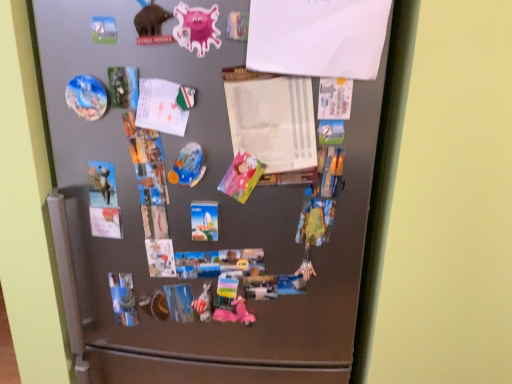
Where is `metallic silver statue at center, which appears as the second art when viewed from the right`? The width and height of the screenshot is (512, 384). metallic silver statue at center, which appears as the second art when viewed from the right is located at coordinates (204, 303).

Locate an element on the screen. The height and width of the screenshot is (384, 512). matte plastic magnet at upper left, the 4th art positioned from the bottom is located at coordinates (86, 97).

Image resolution: width=512 pixels, height=384 pixels. What do you see at coordinates (317, 37) in the screenshot?
I see `white paper at upper center, the first paper positioned from the front` at bounding box center [317, 37].

You are a GUI agent. You are given a task and a screenshot of the screen. Output one action in this format:
    pyautogui.click(x=<x>, y=<y>)
    Task: Click on the white paper at center, the 1th paper from the back
    The width and height of the screenshot is (512, 384).
    Given the screenshot: What is the action you would take?
    pyautogui.click(x=273, y=121)

Is white paper at upper center, positioned as the 1th paper in top-to-bottom order, not close to shiny metallic plate at center, positioned as the third art in bottom-to-top order?

They are positioned close to each other.

From the image's perspective, is white paper at upper center, acting as the 2th paper starting from the bottom, located above or below shiny metallic plate at center, the 3th art viewed from the right?

white paper at upper center, acting as the 2th paper starting from the bottom, is situated higher than shiny metallic plate at center, the 3th art viewed from the right, in the image.

Is white paper at upper center, arranged as the second paper when viewed from the back, in front of or behind shiny metallic plate at center, the 3th art viewed from the right, in the image?

white paper at upper center, arranged as the second paper when viewed from the back, is positioned closer to the viewer than shiny metallic plate at center, the 3th art viewed from the right.

Who is taller, white paper at upper center, arranged as the second paper when viewed from the back, or shiny metallic plate at center, the second art from the left?

Standing taller between the two is white paper at upper center, arranged as the second paper when viewed from the back.

Does shiny metallic plate at center, the second art from the left, have a smaller size compared to metallic silver statue at center, marked as the third art in a left-to-right arrangement?

No, shiny metallic plate at center, the second art from the left, is not smaller than metallic silver statue at center, marked as the third art in a left-to-right arrangement.

Which object is closer to the camera, shiny metallic plate at center, positioned as the third art in bottom-to-top order, or metallic silver statue at center, marked as the third art in a left-to-right arrangement?

shiny metallic plate at center, positioned as the third art in bottom-to-top order.

Could you tell me if shiny metallic plate at center, the second art from the left, is facing metallic silver statue at center, which appears as the second art when viewed from the right?

No, shiny metallic plate at center, the second art from the left, is not turned towards metallic silver statue at center, which appears as the second art when viewed from the right.

Is point (183, 172) behind point (204, 314)?

No.

Would you say matte plastic magnet at upper left, the 4th art positioned from the bottom, is outside metallic silver statue at center, marked as the third art in a left-to-right arrangement?

Yes, matte plastic magnet at upper left, the 4th art positioned from the bottom, is outside of metallic silver statue at center, marked as the third art in a left-to-right arrangement.

Find the location of a particular element. art that is the 2nd object located behind the matte plastic magnet at upper left, positioned as the first art in top-to-bottom order is located at coordinates (204, 303).

Considering the sizes of objects matte plastic magnet at upper left, which is counted as the 4th art, starting from the right, and metallic silver statue at center, marked as the third art in a left-to-right arrangement, in the image provided, who is thinner, matte plastic magnet at upper left, which is counted as the 4th art, starting from the right, or metallic silver statue at center, marked as the third art in a left-to-right arrangement,?

Thinner between the two is matte plastic magnet at upper left, which is counted as the 4th art, starting from the right.

Which object is closer to the camera, pastel paper art at center, which is the fourth art in left-to-right order, or satin silver fridge at center?

Positioned in front is satin silver fridge at center.

Is pastel paper art at center, which is the fourth art in left-to-right order, touching satin silver fridge at center?

No, pastel paper art at center, which is the fourth art in left-to-right order, is not with satin silver fridge at center.

From the image's perspective, is pastel paper art at center, which is the fourth art in left-to-right order, located above satin silver fridge at center?

Correct, pastel paper art at center, which is the fourth art in left-to-right order, appears higher than satin silver fridge at center in the image.

Would you say pastel paper art at center, the 1th art when ordered from right to left, is inside or outside satin silver fridge at center?

pastel paper art at center, the 1th art when ordered from right to left, can be found inside satin silver fridge at center.

This screenshot has height=384, width=512. I want to click on refrigerator above the metallic silver statue at center, which appears as the second art when viewed from the right (from the image's perspective), so click(191, 222).

Considering the points (208, 317) and (170, 27), which point is in front, point (208, 317) or point (170, 27)?

Point (170, 27)

Which object is more forward, metallic silver statue at center, the 4th art when ordered from top to bottom, or satin silver fridge at center?

satin silver fridge at center.

Would you say white paper at center, the first paper ordered from the bottom, is part of shiny metallic plate at center, the second art from the left,'s contents?

No, white paper at center, the first paper ordered from the bottom, is located outside of shiny metallic plate at center, the second art from the left.

Is white paper at center, the 1th paper from the back, at the back of shiny metallic plate at center, the 3th art viewed from the right?

No, shiny metallic plate at center, the 3th art viewed from the right, is not facing the opposite direction of white paper at center, the 1th paper from the back.

Looking at this image, does shiny metallic plate at center, the 2th art from the top, have a lesser height compared to white paper at center, the 2th paper when ordered from top to bottom?

Yes, shiny metallic plate at center, the 2th art from the top, is shorter than white paper at center, the 2th paper when ordered from top to bottom.

Can we say white paper at center, the first paper ordered from the bottom, lies outside satin silver fridge at center?

That's incorrect, white paper at center, the first paper ordered from the bottom, is not completely outside satin silver fridge at center.

Considering the relative sizes of white paper at center, the 2th paper when ordered from top to bottom, and satin silver fridge at center in the image provided, is white paper at center, the 2th paper when ordered from top to bottom, smaller than satin silver fridge at center?

Yes, white paper at center, the 2th paper when ordered from top to bottom, is smaller than satin silver fridge at center.

Is white paper at center, the 2th paper when ordered from top to bottom, positioned with its back to satin silver fridge at center?

Yes, white paper at center, the 2th paper when ordered from top to bottom, is facing away from satin silver fridge at center.

This screenshot has width=512, height=384. There is a shiny metallic plate at center, the 3th art viewed from the right. What are the coordinates of `the 2nd paper above it (from the image's perspective)` in the screenshot? It's located at (317, 37).

There is a metallic silver statue at center, which appears as the second art when viewed from the right. At what (x,y) coordinates should I click in order to perform the action: click on the 2nd art above it (from a real-world perspective). Please return your answer as a coordinate pair (x, y). Image resolution: width=512 pixels, height=384 pixels. Looking at the image, I should click on (188, 166).

Considering their positions, is matte plastic magnet at upper left, which is counted as the 4th art, starting from the right, positioned further to white paper at upper center, positioned as the 1th paper in top-to-bottom order, than white paper at center, the first paper ordered from the bottom?

matte plastic magnet at upper left, which is counted as the 4th art, starting from the right, is further to white paper at upper center, positioned as the 1th paper in top-to-bottom order.

Considering their positions, is pastel paper art at center, the third art in the top-to-bottom sequence, positioned closer to metallic silver statue at center, marked as the 1th art in a bottom-to-top arrangement, than shiny metallic plate at center, positioned as the third art in bottom-to-top order?

pastel paper art at center, the third art in the top-to-bottom sequence, lies closer to metallic silver statue at center, marked as the 1th art in a bottom-to-top arrangement, than the other object.

Which object lies further to the anchor point metallic silver statue at center, the 4th art when ordered from top to bottom, satin silver fridge at center or white paper at center, placed as the second paper when sorted from front to back?

Based on the image, white paper at center, placed as the second paper when sorted from front to back, appears to be further to metallic silver statue at center, the 4th art when ordered from top to bottom.

Estimate the real-world distances between objects in this image. Which object is further from shiny metallic plate at center, the second art from the left, white paper at upper center, arranged as the second paper when viewed from the back, or pastel paper art at center, the third art in the top-to-bottom sequence?

Among the two, white paper at upper center, arranged as the second paper when viewed from the back, is located further to shiny metallic plate at center, the second art from the left.

Based on their spatial positions, is white paper at center, the 2th paper when ordered from top to bottom, or shiny metallic plate at center, the 2th art from the top, closer to pastel paper art at center, marked as the second art in a bottom-to-top arrangement?

Based on the image, shiny metallic plate at center, the 2th art from the top, appears to be nearer to pastel paper art at center, marked as the second art in a bottom-to-top arrangement.

Based on their spatial positions, is white paper at center, the 2th paper when ordered from top to bottom, or white paper at upper center, acting as the 2th paper starting from the bottom, further from metallic silver statue at center, which appears as the second art when viewed from the right?

Based on the image, white paper at upper center, acting as the 2th paper starting from the bottom, appears to be further to metallic silver statue at center, which appears as the second art when viewed from the right.

From the image, which object appears to be nearer to matte plastic magnet at upper left, the 4th art positioned from the bottom, pastel paper art at center, marked as the second art in a bottom-to-top arrangement, or metallic silver statue at center, which appears as the second art when viewed from the right?

pastel paper art at center, marked as the second art in a bottom-to-top arrangement, lies closer to matte plastic magnet at upper left, the 4th art positioned from the bottom, than the other object.

When comparing their distances from white paper at center, the 1th paper from the back, does matte plastic magnet at upper left, placed as the first art when sorted from left to right, or metallic silver statue at center, the 4th art when ordered from top to bottom, seem further?

Based on the image, metallic silver statue at center, the 4th art when ordered from top to bottom, appears to be further to white paper at center, the 1th paper from the back.

Identify the location of paper between white paper at upper center, arranged as the second paper when viewed from the back, and satin silver fridge at center, in the vertical direction. Image resolution: width=512 pixels, height=384 pixels. (273, 121).

The image size is (512, 384). Identify the location of refrigerator between pastel paper art at center, marked as the second art in a bottom-to-top arrangement, and metallic silver statue at center, which appears as the second art when viewed from the right, vertically. (191, 222).

Identify the location of paper between white paper at upper center, the first paper positioned from the front, and pastel paper art at center, the third art in the top-to-bottom sequence, from top to bottom. (273, 121).

Where is `refrigerator between matte plastic magnet at upper left, the 4th art positioned from the bottom, and pastel paper art at center, marked as the second art in a bottom-to-top arrangement`? The image size is (512, 384). refrigerator between matte plastic magnet at upper left, the 4th art positioned from the bottom, and pastel paper art at center, marked as the second art in a bottom-to-top arrangement is located at coordinates point(191,222).